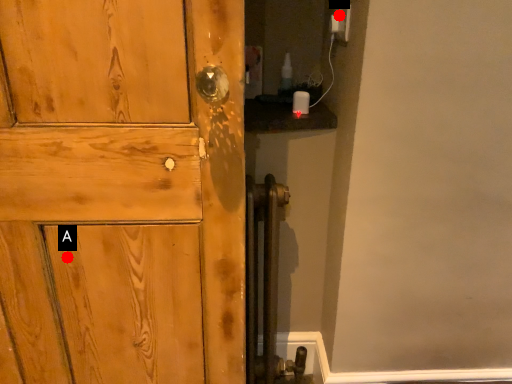
Question: Two points are circled on the image, labeled by A and B beside each circle. Which point is further to the camera?

Choices:
 (A) A is further
 (B) B is further

Answer: (B)